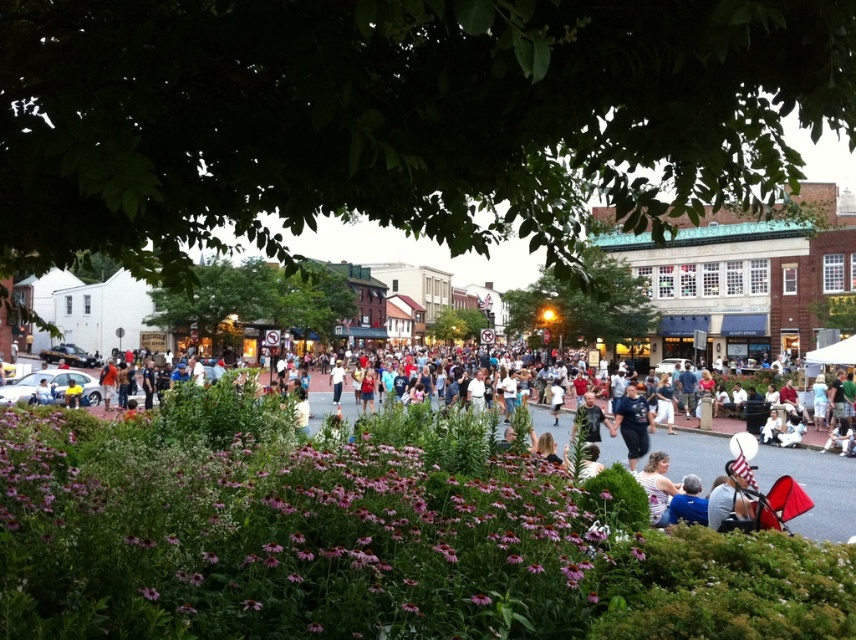
Question: Is dark blue jeans at center positioned behind blue fabric at lower right?

Choices:
 (A) no
 (B) yes

Answer: (B)

Question: Which is nearer to the purple matte flowers at center?

Choices:
 (A) light brown hair at lower center
 (B) blue fabric at lower right
 (C) dark blue jeans at center

Answer: (A)

Question: Which of the following is the closest to the observer?

Choices:
 (A) (669, 499)
 (B) (328, 554)

Answer: (B)

Question: Which object is the farthest from the blue fabric at lower right?

Choices:
 (A) light brown hair at lower center
 (B) purple matte flowers at center

Answer: (B)

Question: Can you confirm if dark blue jeans at center is positioned below blue fabric at lower right?

Choices:
 (A) yes
 (B) no

Answer: (B)

Question: Is purple matte flowers at center positioned before dark blue jeans at center?

Choices:
 (A) no
 (B) yes

Answer: (B)